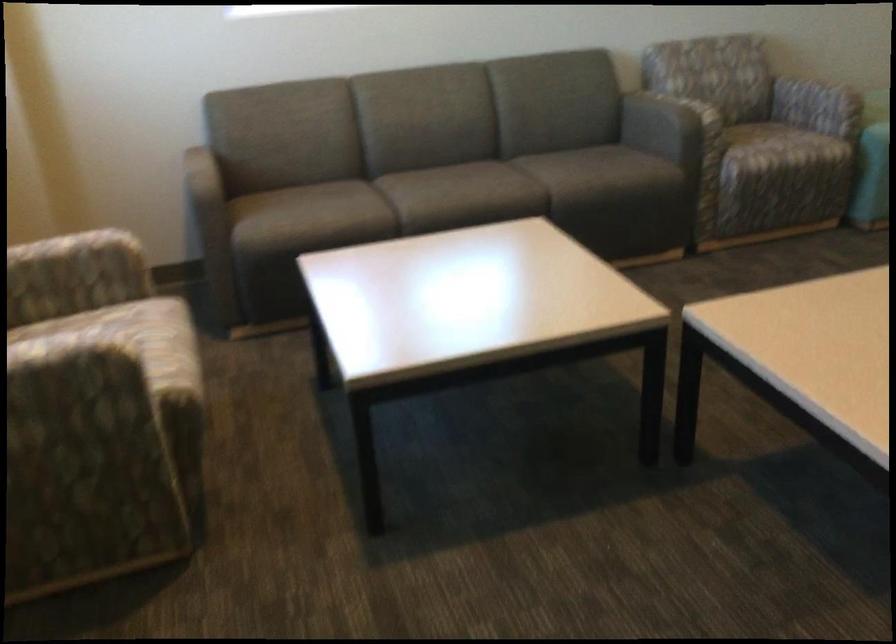
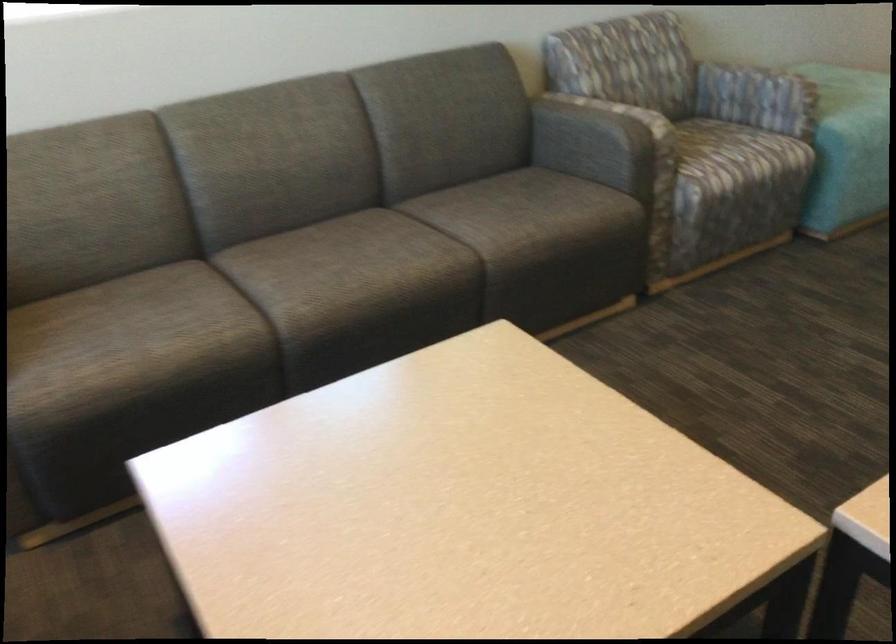
Locate, in the second image, the point that corresponds to pixel 778 146 in the first image.

(737, 155)